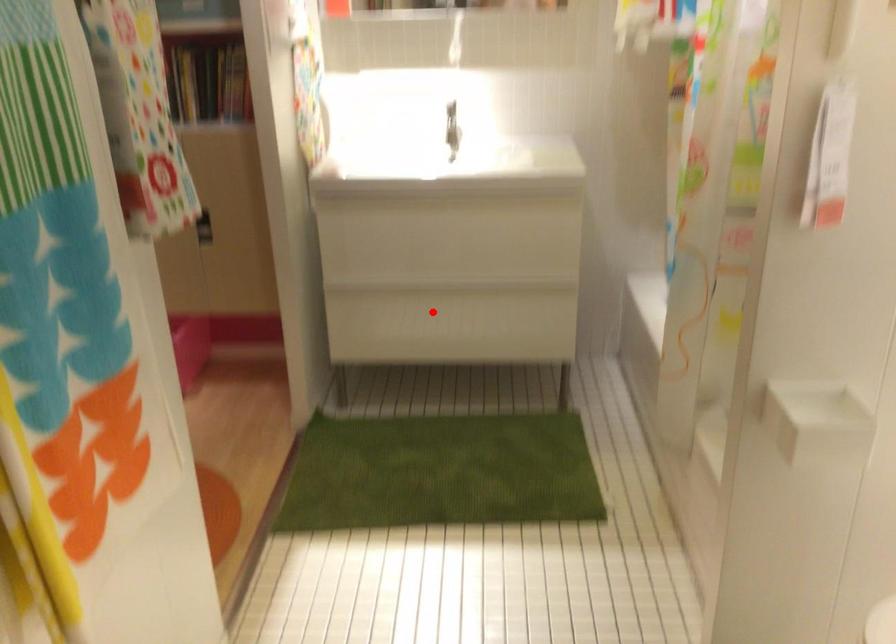
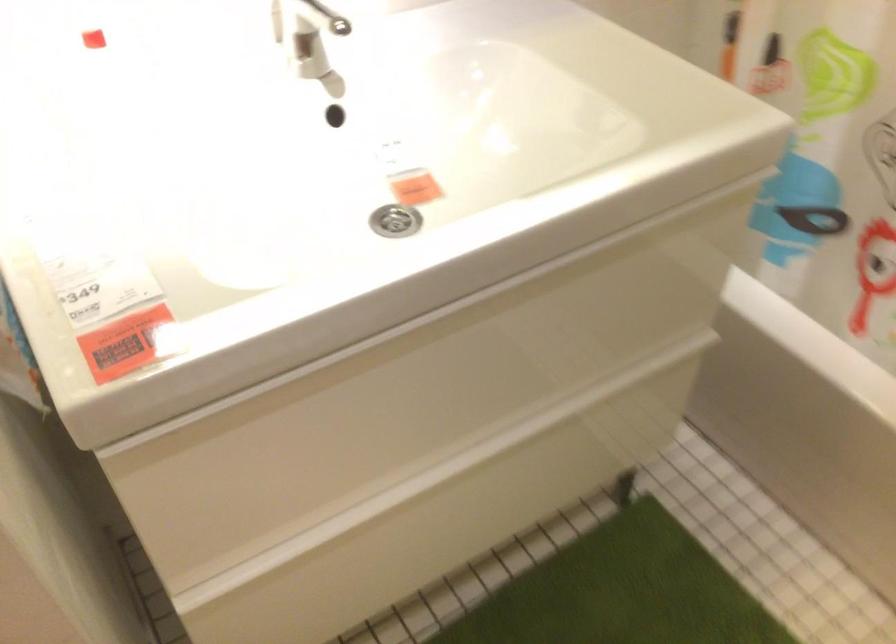
In the second image, find the point that corresponds to the highlighted location in the first image.

(442, 514)